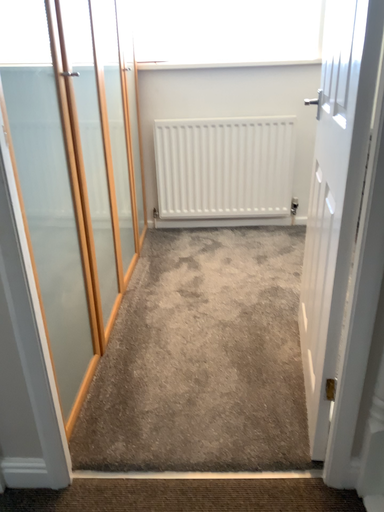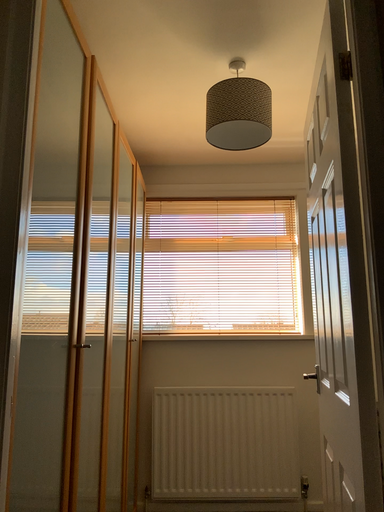
Question: How did the camera likely rotate when shooting the video?

Choices:
 (A) rotated downward
 (B) rotated upward

Answer: (B)